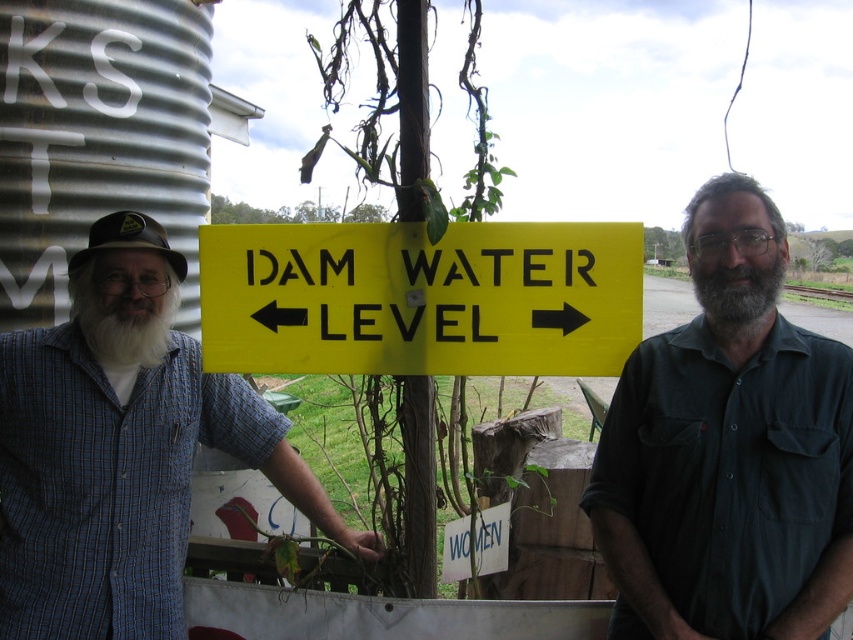
Question: Which object is farther from the camera taking this photo?

Choices:
 (A) white matte beard at left
 (B) gray matte beard at center
 (C) blue plaid shirt at left
 (D) dark green shirt at center

Answer: (A)

Question: Does dark green shirt at center appear on the right side of gray matte beard at center?

Choices:
 (A) no
 (B) yes

Answer: (A)

Question: Among these objects, which one is nearest to the camera?

Choices:
 (A) white matte beard at left
 (B) gray matte beard at center
 (C) dark green shirt at center

Answer: (C)

Question: Can you confirm if dark green shirt at center is wider than white matte beard at left?

Choices:
 (A) no
 (B) yes

Answer: (B)

Question: Is yellow plastic sign at center above gray matte beard at center?

Choices:
 (A) yes
 (B) no

Answer: (B)

Question: Which of the following is the farthest from the observer?

Choices:
 (A) dark green shirt at center
 (B) gray matte beard at center

Answer: (B)